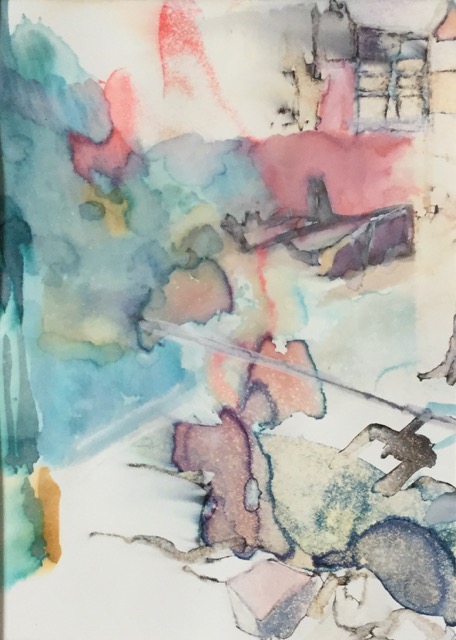
This screenshot has width=456, height=640. I want to click on abstract art, so click(241, 282).